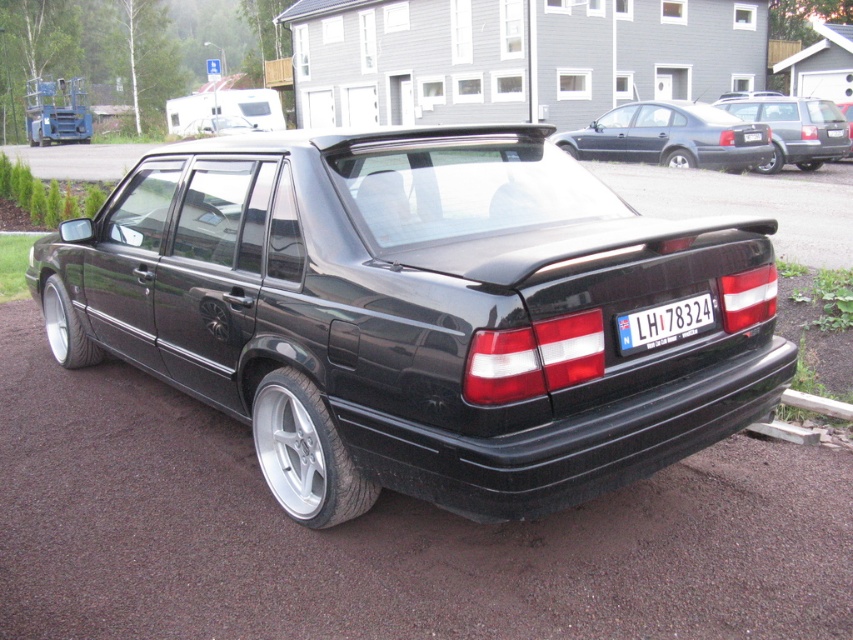
Question: Does black matte car at center appear on the right side of white plastic license plate at rear?

Choices:
 (A) yes
 (B) no

Answer: (B)

Question: Which is nearer to the white plastic license plate at center?

Choices:
 (A) black asphalt at center
 (B) black matte car at center
 (C) matte black sedan at upper right

Answer: (C)

Question: Is black matte car at center smaller than white plastic license plate at center?

Choices:
 (A) yes
 (B) no

Answer: (B)

Question: Does black rubber car at center appear on the right side of white plastic license plate at rear?

Choices:
 (A) no
 (B) yes

Answer: (A)

Question: Among these objects, which one is nearest to the camera?

Choices:
 (A) white plastic license plate at center
 (B) black rubber car at center
 (C) white plastic license plate at rear
 (D) matte black sedan at upper right

Answer: (C)

Question: Which of the following is the closest to the observer?

Choices:
 (A) black asphalt at center
 (B) matte black car at upper right
 (C) white plastic license plate at rear
 (D) white plastic license plate at center

Answer: (A)